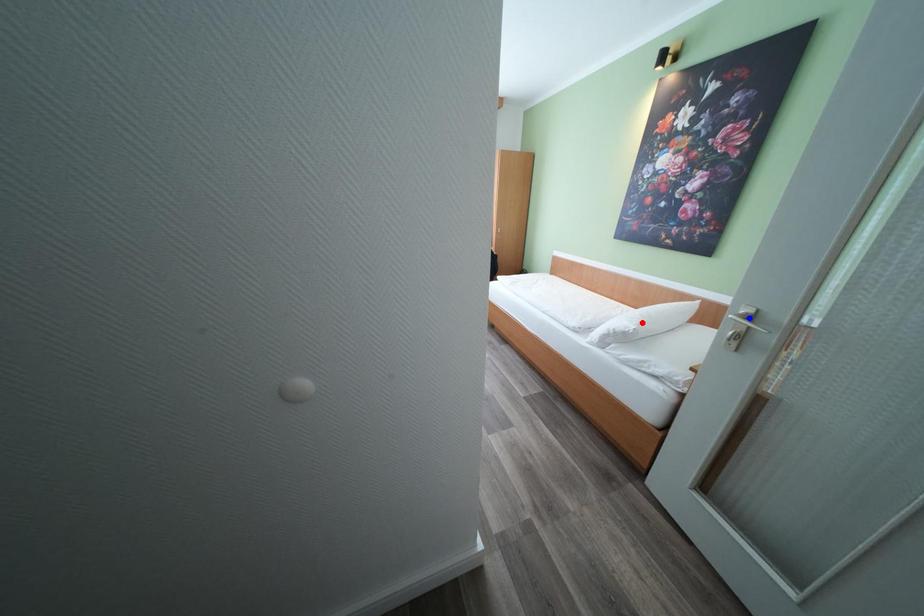
Question: Two points are marked on the image. Which point is closer to the camera?

Choices:
 (A) Blue point is closer.
 (B) Red point is closer.

Answer: (A)